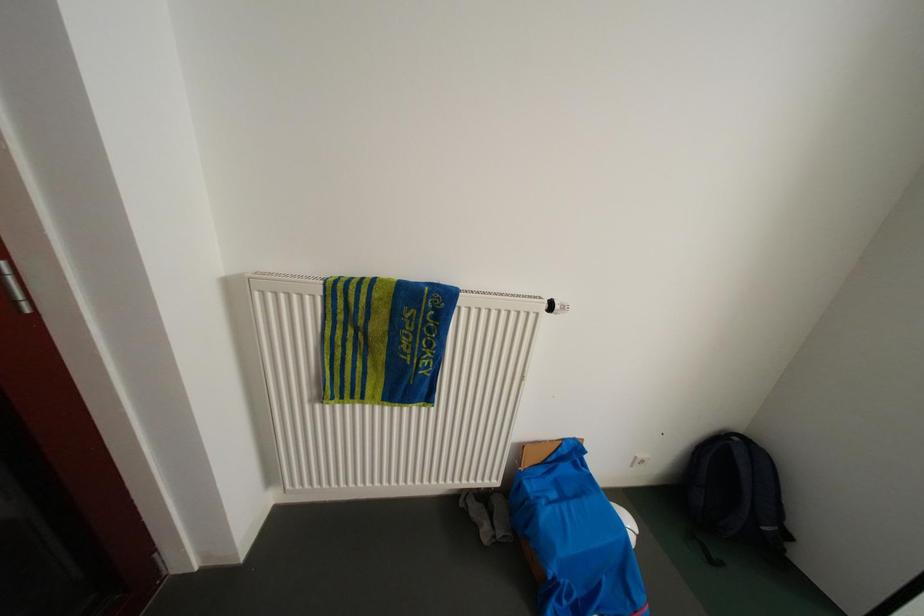
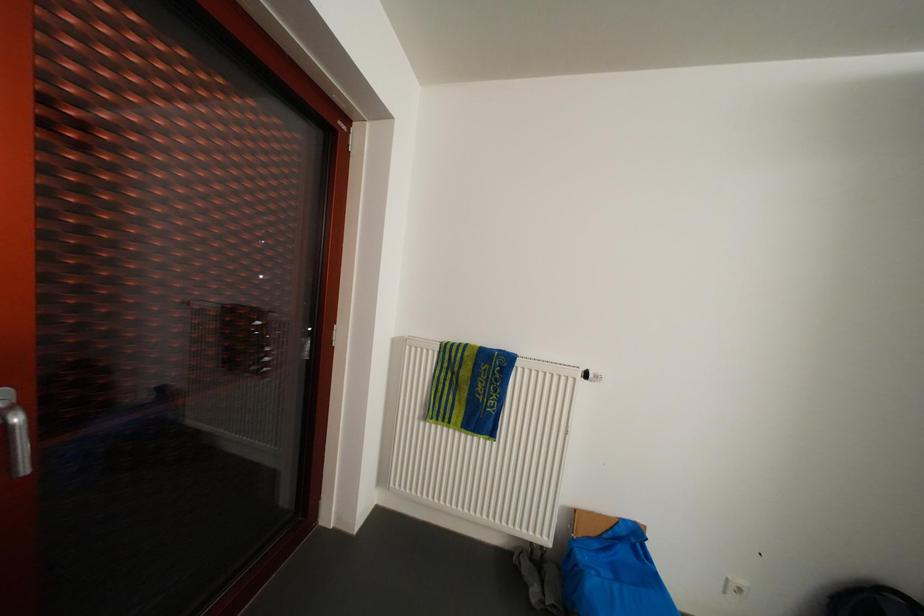
The images are taken continuously from a first-person perspective. In which direction is your viewpoint rotating?

The rotation direction of the camera is left-up.